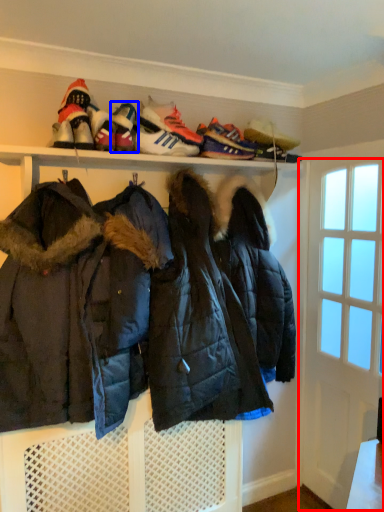
Question: Which point is further to the camera, door (highlighted by a red box) or footwear (highlighted by a blue box)?

Choices:
 (A) door
 (B) footwear

Answer: (A)